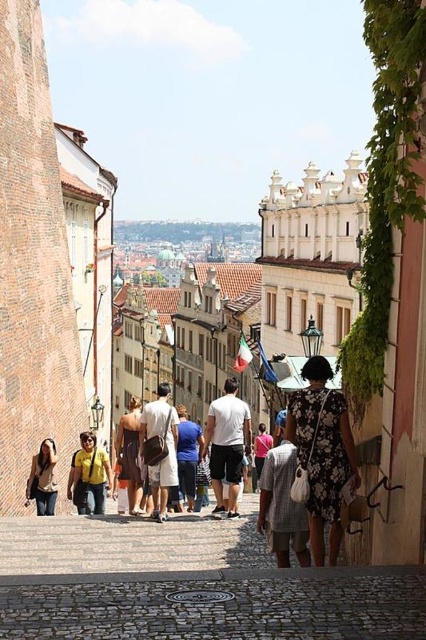
Question: Can you confirm if floral dress at center is positioned above yellow fabric shirt at center?

Choices:
 (A) no
 (B) yes

Answer: (B)

Question: Can you confirm if cobblestone path at center is positioned to the right of light brown leather jacket at lower left?

Choices:
 (A) yes
 (B) no

Answer: (A)

Question: Can you confirm if white cotton t-shirt at center is positioned below white cotton shirt at center?

Choices:
 (A) no
 (B) yes

Answer: (A)

Question: Which point is closer to the camera?

Choices:
 (A) yellow fabric shirt at center
 (B) white cotton t-shirt at center
 (C) pink fabric dress at center
 (D) white cotton shirt at center

Answer: (D)

Question: Considering the real-world distances, which object is farthest from the dark brown dress at center?

Choices:
 (A) floral dress at center
 (B) white cotton t-shirt at center

Answer: (A)

Question: Which point is closer to the camera taking this photo?

Choices:
 (A) (236, 483)
 (B) (120, 472)
 (C) (207, 576)
 (D) (299, 520)

Answer: (C)